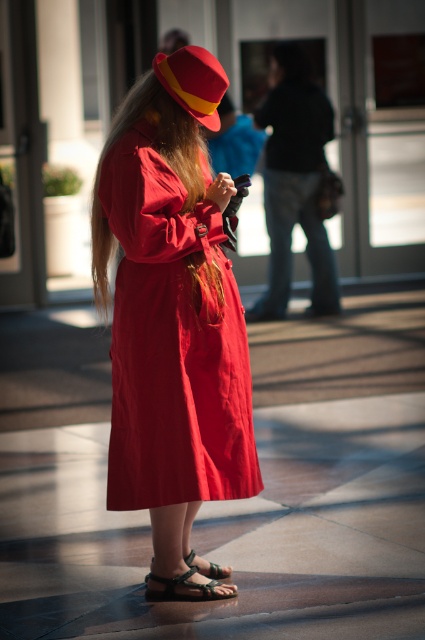
Question: Is shiny golden hair at center wider than green leather sandal at lower center?

Choices:
 (A) no
 (B) yes

Answer: (B)

Question: Which point appears closest to the camera in this image?

Choices:
 (A) (189, 598)
 (B) (192, 106)
 (C) (198, 260)

Answer: (C)

Question: Is matte red dress at center to the right of green leather sandal at lower center from the viewer's perspective?

Choices:
 (A) no
 (B) yes

Answer: (A)

Question: Which of these objects is positioned closest to the matte red dress at center?

Choices:
 (A) green woven sandal at lower center
 (B) shiny golden hair at center

Answer: (B)

Question: Can you confirm if green leather sandal at lower center is thinner than green woven sandal at lower center?

Choices:
 (A) yes
 (B) no

Answer: (B)

Question: Based on their relative distances, which object is farther from the green leather sandal at lower center?

Choices:
 (A) shiny golden hair at center
 (B) green woven sandal at lower center
 (C) matte red and yellow hat at upper center
 (D) matte red dress at center

Answer: (C)